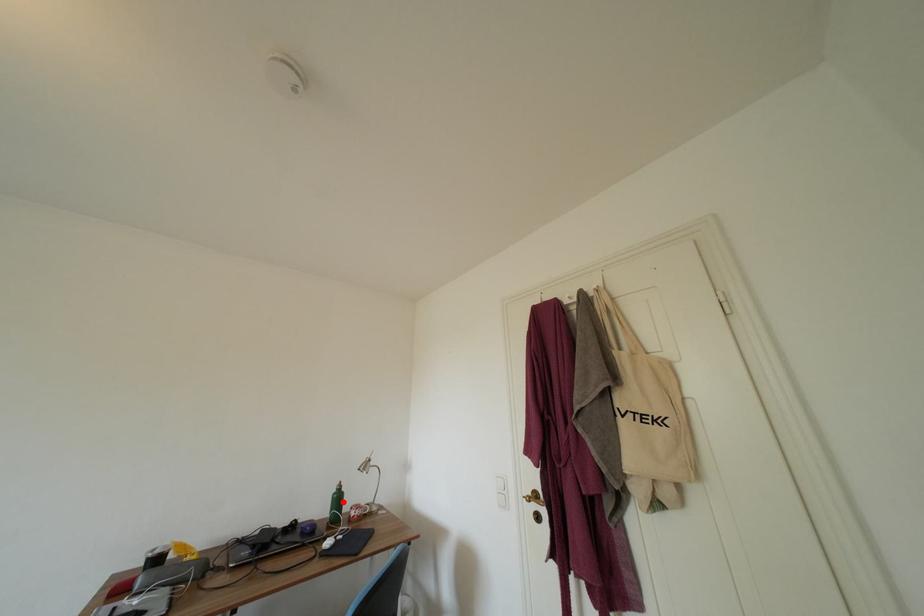
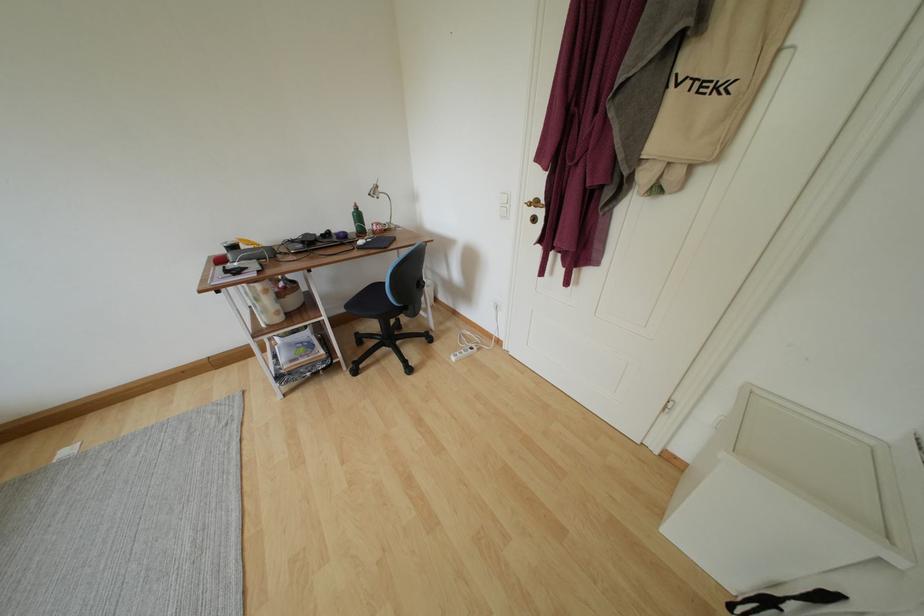
In the second image, find the point that corresponds to the highlighted location in the first image.

(363, 220)